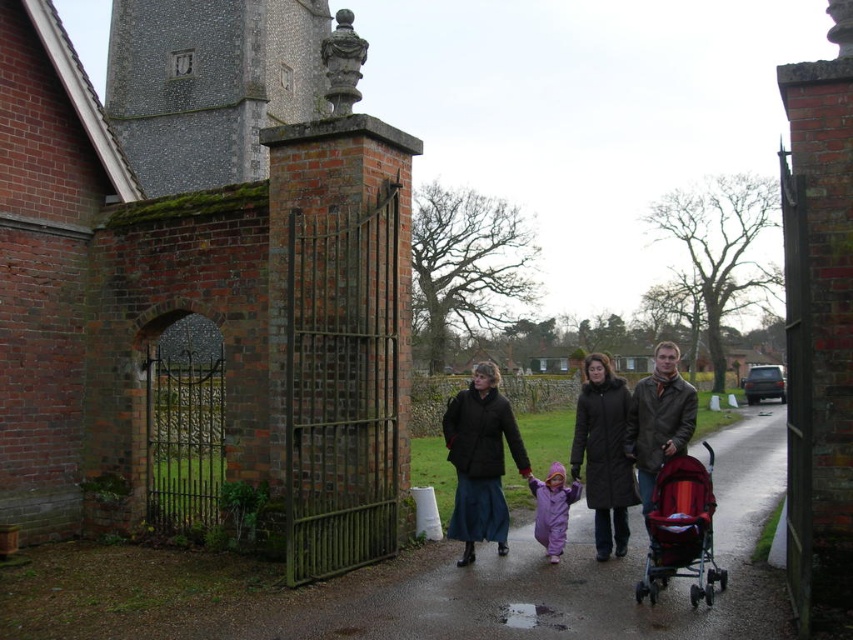
Does purple fleece jacket at center appear on the left side of matte black coat at center?

No, purple fleece jacket at center is not to the left of matte black coat at center.

Is purple fleece jacket at center positioned at the back of matte black coat at center?

That is False.

At what (x,y) coordinates should I click in order to perform the action: click on purple fleece jacket at center. Please return your answer as a coordinate pair (x, y). This screenshot has height=640, width=853. Looking at the image, I should click on (627, 438).

Does purple fleece jacket at center appear under red fabric stroller at right?

No.

Consider the image. Does purple fleece jacket at center appear on the left side of red fabric stroller at right?

No, purple fleece jacket at center is not to the left of red fabric stroller at right.

Locate an element on the screen. Image resolution: width=853 pixels, height=640 pixels. purple fleece jacket at center is located at coordinates (627, 438).

Can you confirm if purple fleece jacket at center is positioned to the left of purple fleece suit at center?

In fact, purple fleece jacket at center is to the right of purple fleece suit at center.

Is point (641, 451) in front of point (550, 476)?

Yes, it is in front of point (550, 476).

Where is `purple fleece jacket at center`? purple fleece jacket at center is located at coordinates pyautogui.click(x=627, y=438).